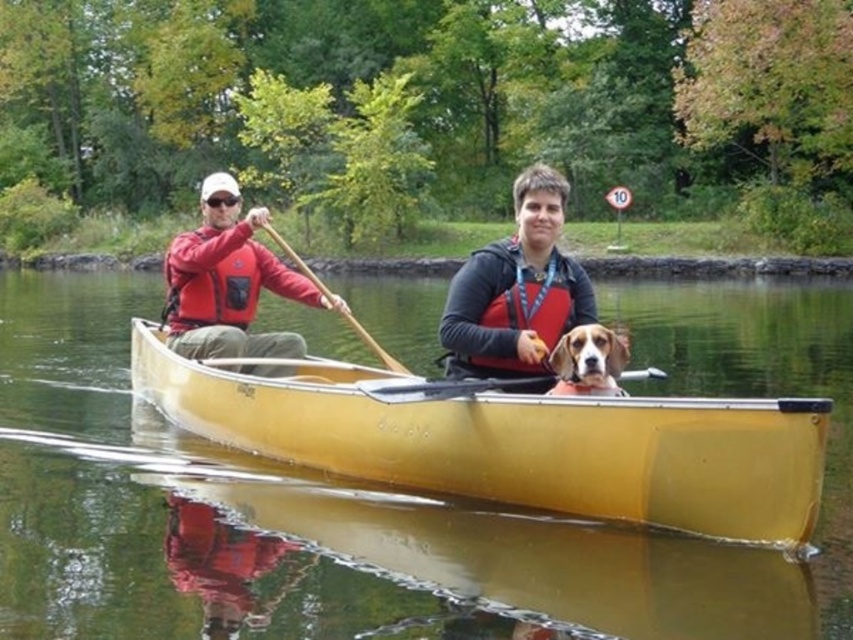
Question: Which point is closer to the camera taking this photo?

Choices:
 (A) pos(498,321)
 (B) pos(260,260)
 (C) pos(199,353)

Answer: (A)

Question: Can you confirm if yellow plastic canoe at center is positioned to the right of red matte life jacket at left?

Choices:
 (A) no
 (B) yes

Answer: (B)

Question: Based on their relative distances, which object is farther from the wooden paddle at center?

Choices:
 (A) matte red life jacket at left
 (B) yellow plastic canoe at center

Answer: (A)

Question: Can you confirm if yellow plastic canoe at center is wider than matte red life jacket at left?

Choices:
 (A) yes
 (B) no

Answer: (B)

Question: Which object is positioned farthest from the brown fur dog at center?

Choices:
 (A) yellow plastic canoe at center
 (B) red matte life jacket at left

Answer: (B)

Question: Is the position of matte red life jacket at left less distant than that of wooden paddle at left?

Choices:
 (A) no
 (B) yes

Answer: (A)